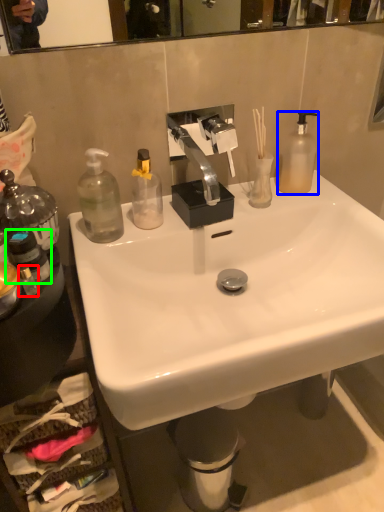
Question: Based on their relative distances, which object is farther from bottle (highlighted by a red box)? Choose from bottle (highlighted by a blue box) and bottle (highlighted by a green box).

Choices:
 (A) bottle
 (B) bottle

Answer: (A)